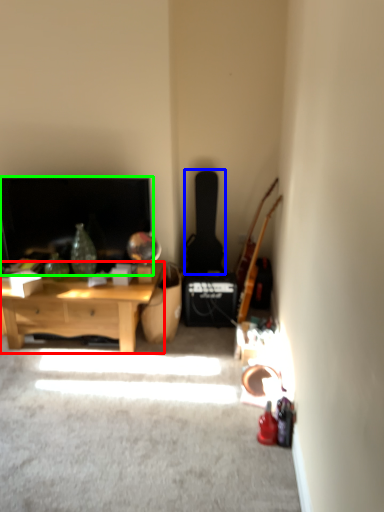
Question: Which object is the closest to the desk (highlighted by a red box)? Choose among these: guitar (highlighted by a blue box) or fireplace (highlighted by a green box).

Choices:
 (A) guitar
 (B) fireplace

Answer: (B)